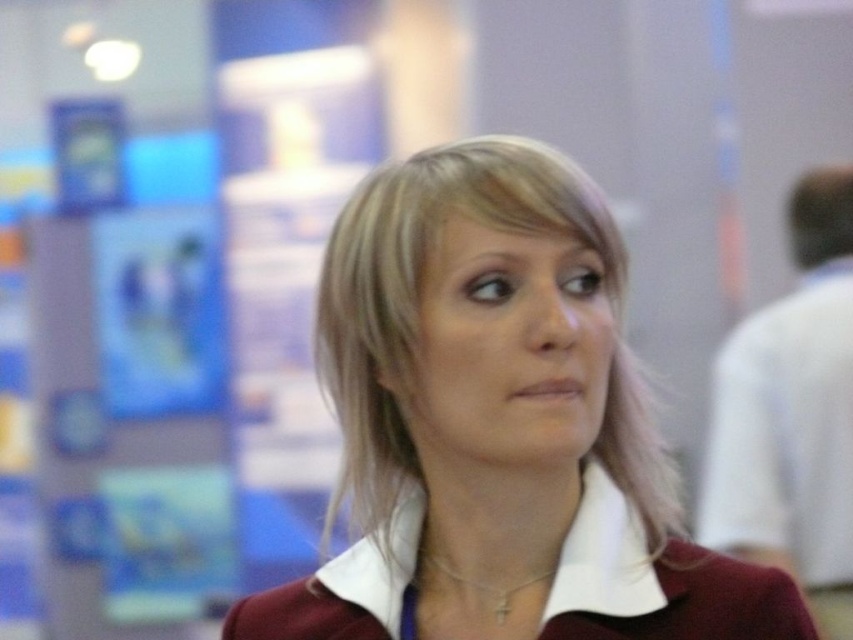
Between point (503, 195) and point (448, 572), which one is positioned behind?

The point (448, 572) is behind.

Is point (390, 394) closer to camera compared to point (500, 595)?

No, it is not.

Describe the element at coordinates (498, 422) in the screenshot. I see `maroon fabric shirt at center` at that location.

Locate an element on the screen. The height and width of the screenshot is (640, 853). maroon fabric shirt at center is located at coordinates (498, 422).

Does white cotton shirt at center appear over gold chain necklace at center?

Yes, white cotton shirt at center is above gold chain necklace at center.

Is point (397, 593) behind point (434, 564)?

No, (397, 593) is in front of (434, 564).

Who is more distant from viewer, (646, 564) or (519, 588)?

The point (519, 588) is behind.

Locate an element on the screen. Image resolution: width=853 pixels, height=640 pixels. white cotton shirt at center is located at coordinates (602, 556).

Measure the distance between point (837, 625) and camera.

Point (837, 625) and camera are 2.06 meters apart.

Locate an element on the screen. white cotton dress shirt at right is located at coordinates (791, 413).

What do you see at coordinates (791, 413) in the screenshot? The height and width of the screenshot is (640, 853). I see `white cotton dress shirt at right` at bounding box center [791, 413].

Locate an element on the screen. This screenshot has width=853, height=640. white cotton dress shirt at right is located at coordinates (791, 413).